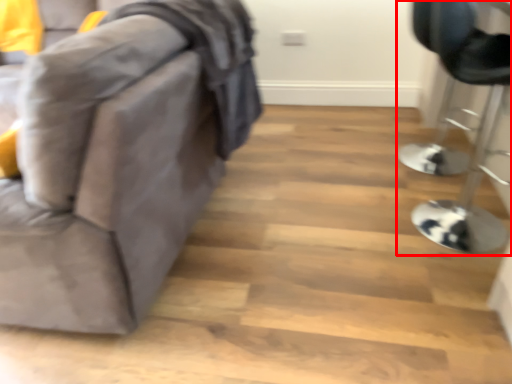
Question: From the image's perspective, what is the correct spatial positioning of furniture (annotated by the red box) in reference to furniture?

Choices:
 (A) above
 (B) below

Answer: (B)